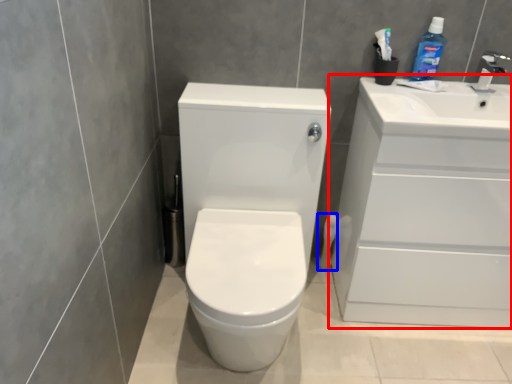
Question: Which object is further to the camera taking this photo, bathroom cabinet (highlighted by a red box) or toilet paper (highlighted by a blue box)?

Choices:
 (A) bathroom cabinet
 (B) toilet paper

Answer: (B)